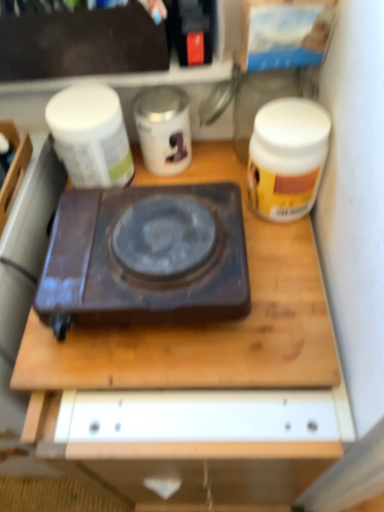
Locate an element on the screen. The height and width of the screenshot is (512, 384). free spot above wooden desk at center (from a real-world perspective) is located at coordinates (220, 349).